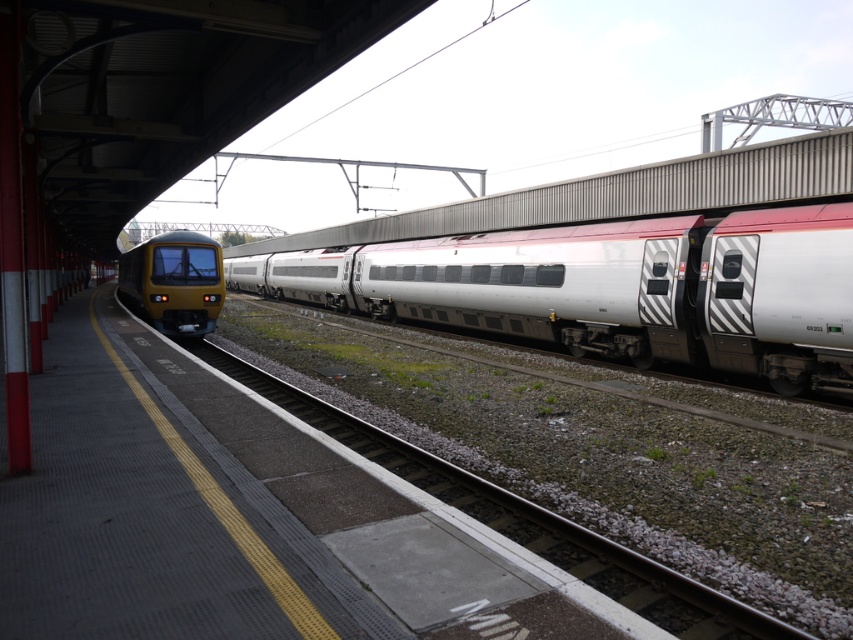
You are a passenger on the platform waiting for your train to depart. You notice gravel at left and a metallic yellow train at left. Which object is closer to the edge of the platform?

The gravel at left is closer to the edge of the platform than the metallic yellow train at left because the gravel is smaller, implying it is positioned nearer to the edge for safety.